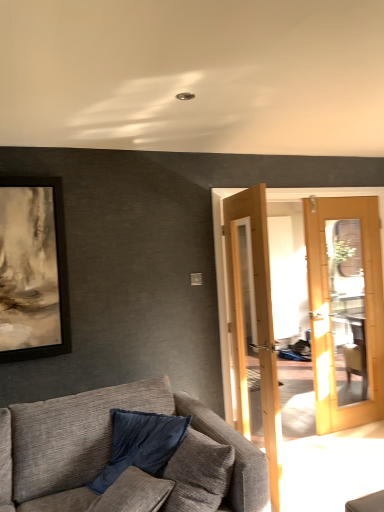
Question: From their relative heights in the image, would you say textured gray couch at lower left is taller or shorter than velvet blue pillow at lower left?

Choices:
 (A) short
 (B) tall

Answer: (B)

Question: Is textured gray couch at lower left inside or outside of velvet blue pillow at lower left?

Choices:
 (A) outside
 (B) inside

Answer: (A)

Question: Is point click(x=240, y=437) closer or farther from the camera than point click(x=148, y=433)?

Choices:
 (A) closer
 (B) farther

Answer: (A)

Question: Is velvet blue pillow at lower left inside the boundaries of textured gray couch at lower left, or outside?

Choices:
 (A) inside
 (B) outside

Answer: (A)

Question: Is velvet blue pillow at lower left bigger or smaller than textured gray couch at lower left?

Choices:
 (A) small
 (B) big

Answer: (A)

Question: Is velvet blue pillow at lower left to the left or to the right of textured gray couch at lower left in the image?

Choices:
 (A) left
 (B) right

Answer: (B)

Question: Considering the positions of point (167, 435) and point (193, 487), is point (167, 435) closer or farther from the camera than point (193, 487)?

Choices:
 (A) closer
 (B) farther

Answer: (B)